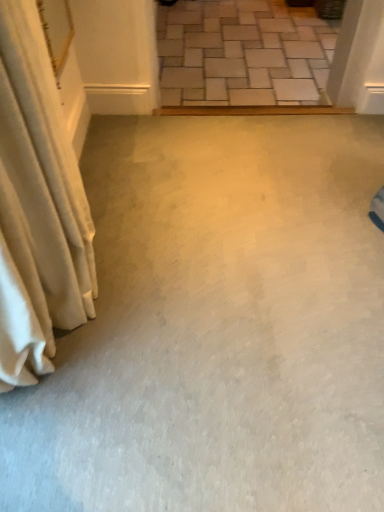
Question: From the image's perspective, is light gray stone steps at upper center above or below white fabric curtain at left?

Choices:
 (A) below
 (B) above

Answer: (B)

Question: From a real-world perspective, is light gray stone steps at upper center positioned above or below white fabric curtain at left?

Choices:
 (A) above
 (B) below

Answer: (B)

Question: Considering the positions of light gray stone steps at upper center and white fabric curtain at left in the image, is light gray stone steps at upper center wider or thinner than white fabric curtain at left?

Choices:
 (A) wide
 (B) thin

Answer: (A)

Question: From a real-world perspective, is white fabric curtain at left positioned above or below light gray stone steps at upper center?

Choices:
 (A) below
 (B) above

Answer: (B)

Question: Based on their sizes in the image, would you say white fabric curtain at left is bigger or smaller than light gray stone steps at upper center?

Choices:
 (A) big
 (B) small

Answer: (B)

Question: In the image, is white fabric curtain at left positioned in front of or behind light gray stone steps at upper center?

Choices:
 (A) behind
 (B) front

Answer: (B)

Question: Is white fabric curtain at left spatially inside light gray stone steps at upper center, or outside of it?

Choices:
 (A) inside
 (B) outside

Answer: (B)